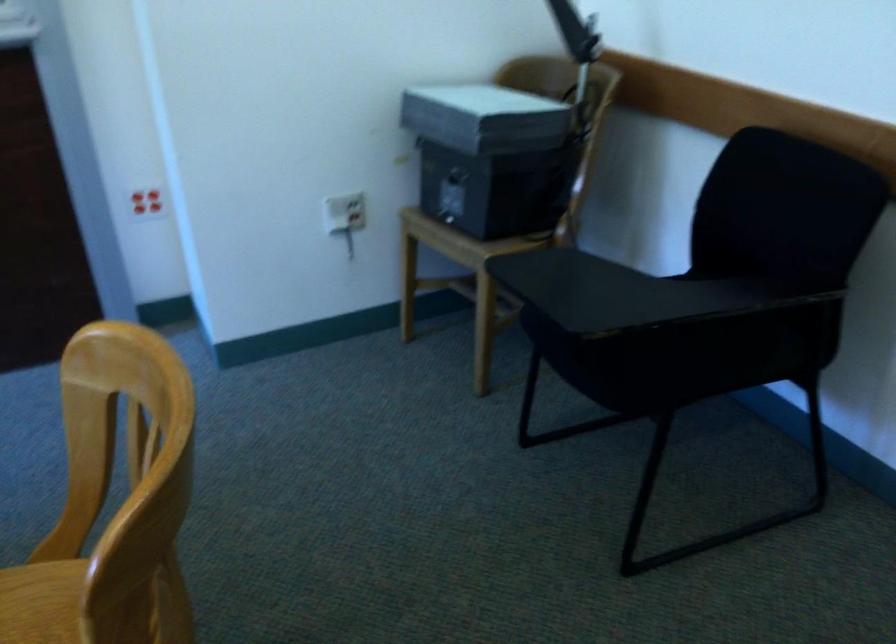
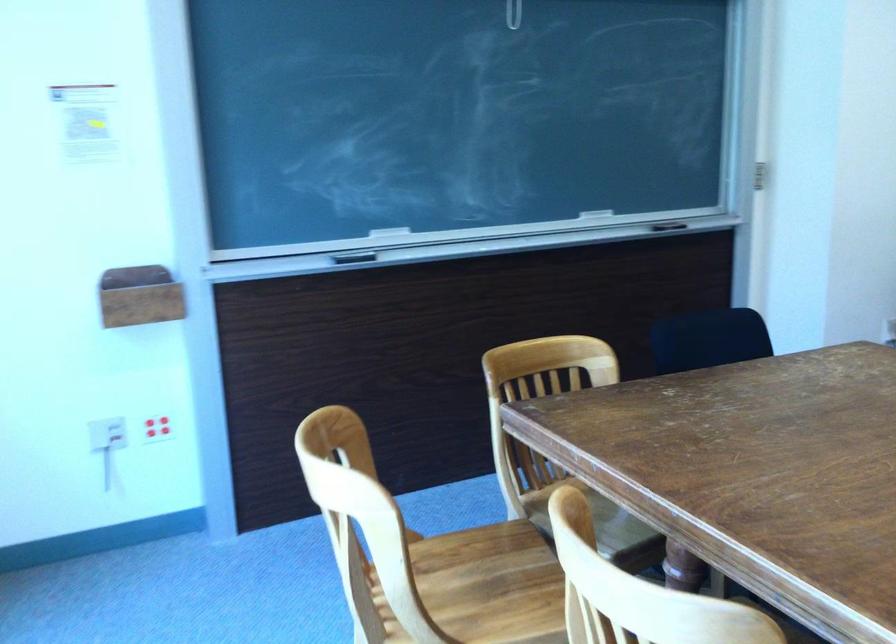
What movement of the cameraman would produce the second image?

The movement direction of the cameraman is left, backward.